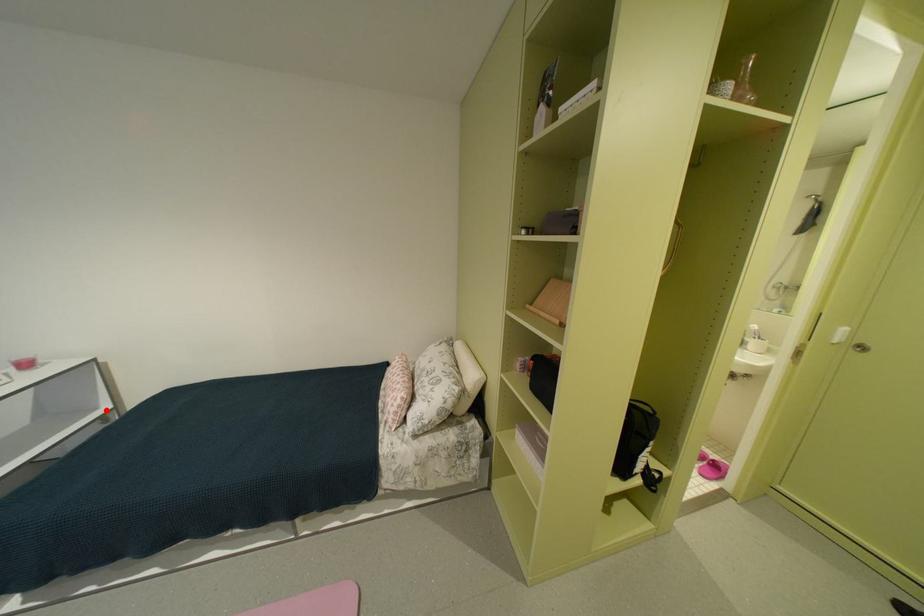
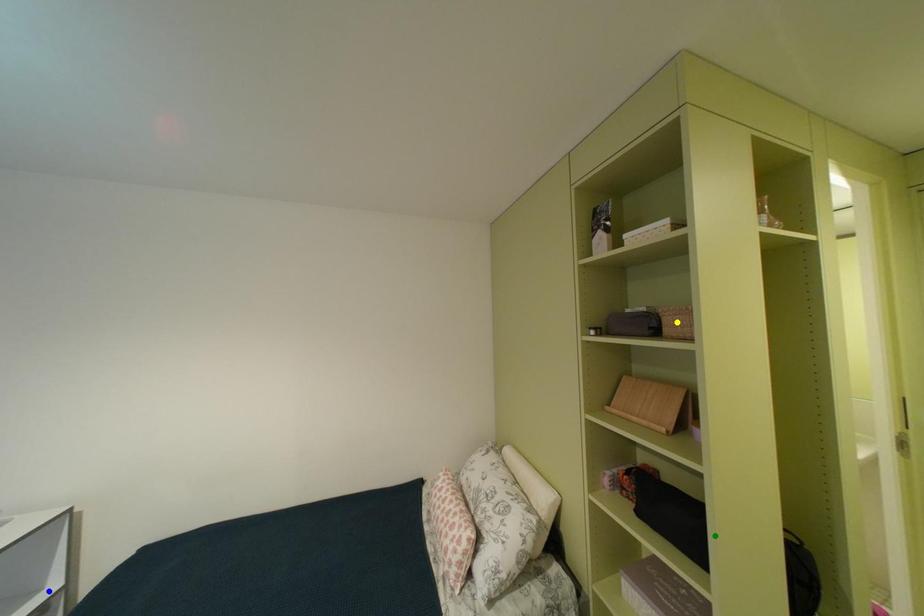
Question: I am providing you with two images of the same scene from different viewpoints. A red point is marked on the first image. You are given multiple points on the second image. Which point in image 2 represents the same 3d spot as the red point in image 1?

Choices:
 (A) blue point
 (B) green point
 (C) yellow point

Answer: (A)